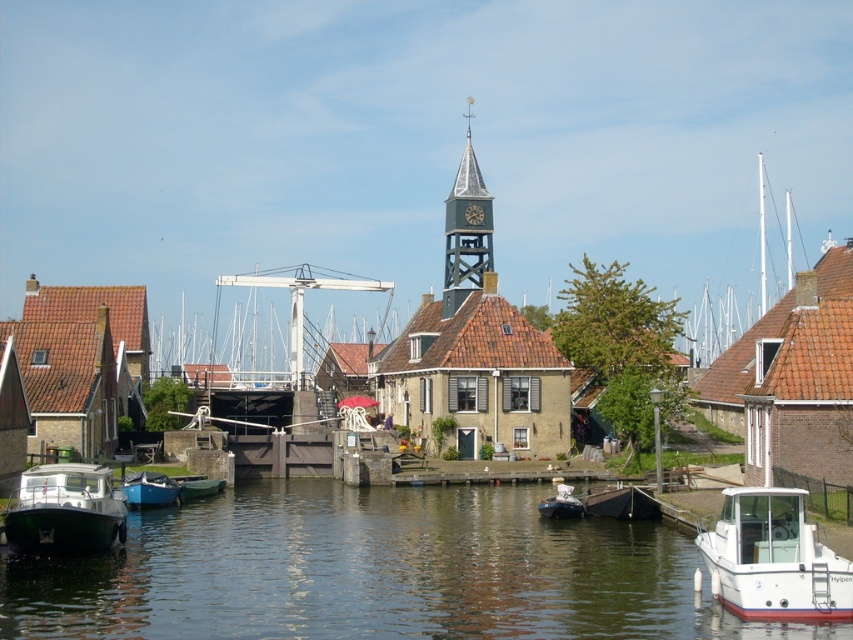
Can you confirm if white glossy boat at lower right is bigger than matte black boat at center?

Correct, white glossy boat at lower right is larger in size than matte black boat at center.

Looking at this image, between white glossy boat at lower right and matte black boat at center, which one appears on the left side from the viewer's perspective?

Positioned to the left is matte black boat at center.

Identify the location of white glossy boat at lower right. This screenshot has height=640, width=853. (773, 560).

The height and width of the screenshot is (640, 853). Find the location of `white glossy boat at lower right`. white glossy boat at lower right is located at coordinates (773, 560).

Between point (741, 556) and point (123, 529), which one is positioned behind?

Point (123, 529)

Which is in front, point (799, 609) or point (27, 480)?

Positioned in front is point (799, 609).

Is point (801, 561) positioned behind point (78, 486)?

That is False.

Where is `white glossy boat at lower right`? The image size is (853, 640). white glossy boat at lower right is located at coordinates (773, 560).

Between black glossy boat at lower left and blue matte boat at lower left, which one is positioned higher?

black glossy boat at lower left is higher up.

Does black glossy boat at lower left have a greater height compared to blue matte boat at lower left?

Yes.

Describe the element at coordinates (67, 509) in the screenshot. This screenshot has width=853, height=640. I see `black glossy boat at lower left` at that location.

The height and width of the screenshot is (640, 853). In order to click on black glossy boat at lower left in this screenshot , I will do `click(67, 509)`.